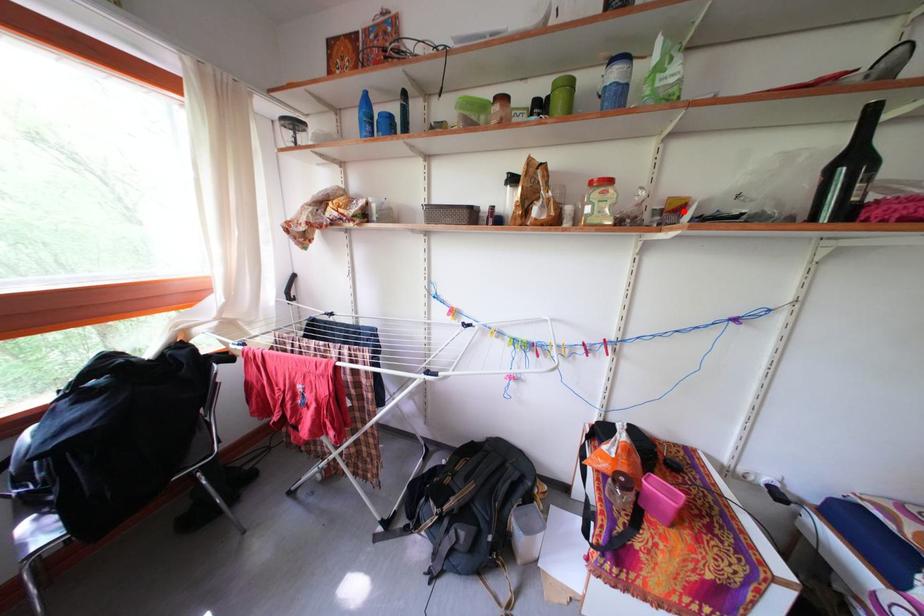
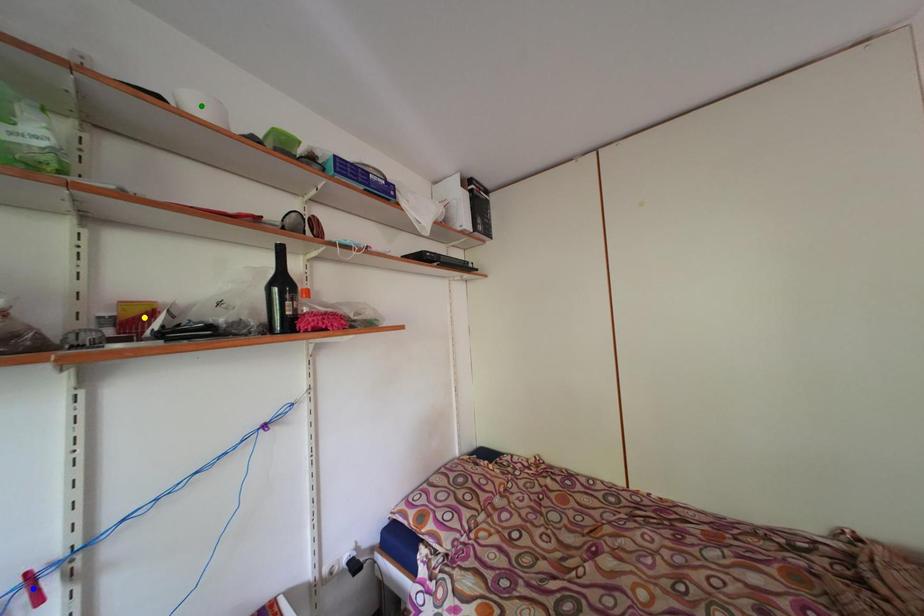
Question: I am providing you with two images of the same scene from different viewpoints. A red point is marked on the first image. You are given multiple points on the second image. Which point in image 2 represents the same 3d spot as the red point in image 1?

Choices:
 (A) blue point
 (B) yellow point
 (C) green point

Answer: (B)